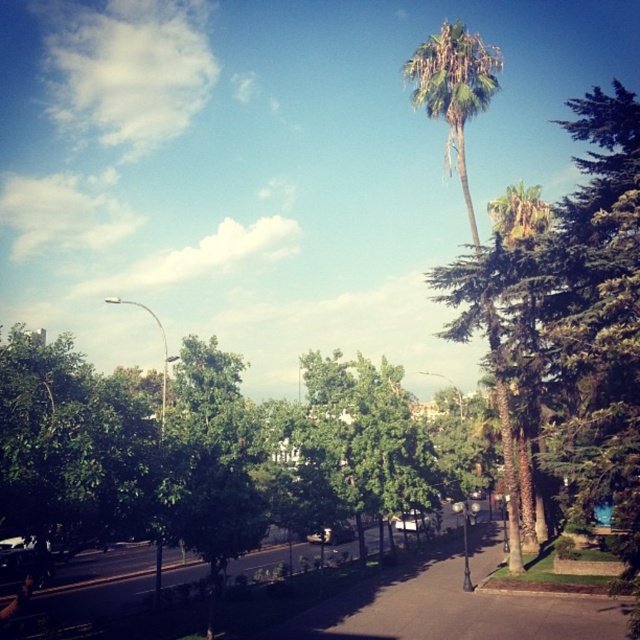
What do you see at coordinates (572, 314) in the screenshot? This screenshot has height=640, width=640. I see `green leafy tree at upper right` at bounding box center [572, 314].

Is green leafy tree at upper right to the right of green leafy palm tree at center from the viewer's perspective?

Yes, green leafy tree at upper right is to the right of green leafy palm tree at center.

Is point (595, 120) in front of point (460, 150)?

Yes.

The width and height of the screenshot is (640, 640). I want to click on green leafy tree at upper right, so click(572, 314).